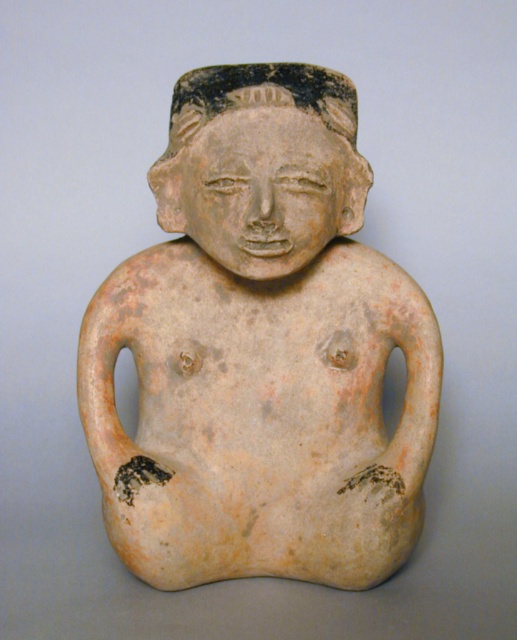
You are an archaeologist examining a prehistoric artifact. You see a point at coordinates (261,349). What does this point indicate?

The point at coordinates (261,349) indicates the location of the matte clay figure at center.

You are an archaeologist examining the ceramic figurine. You notice two points on the figurine. One is at coordinate point (114, 307) and the other at point (249, 88). Which point is closer to you?

Point (114, 307) is further to the camera than point (249, 88), so the point closer to you is point (249, 88).